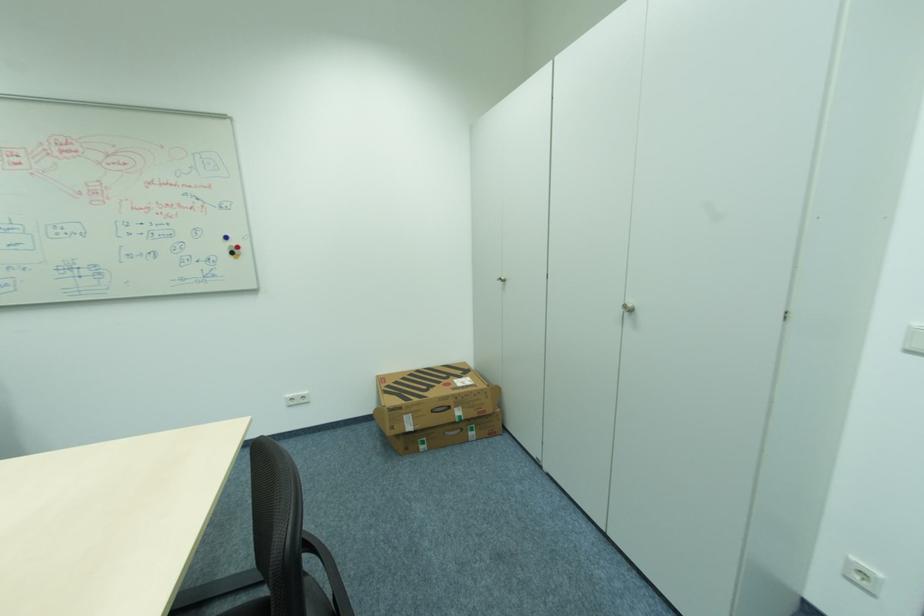
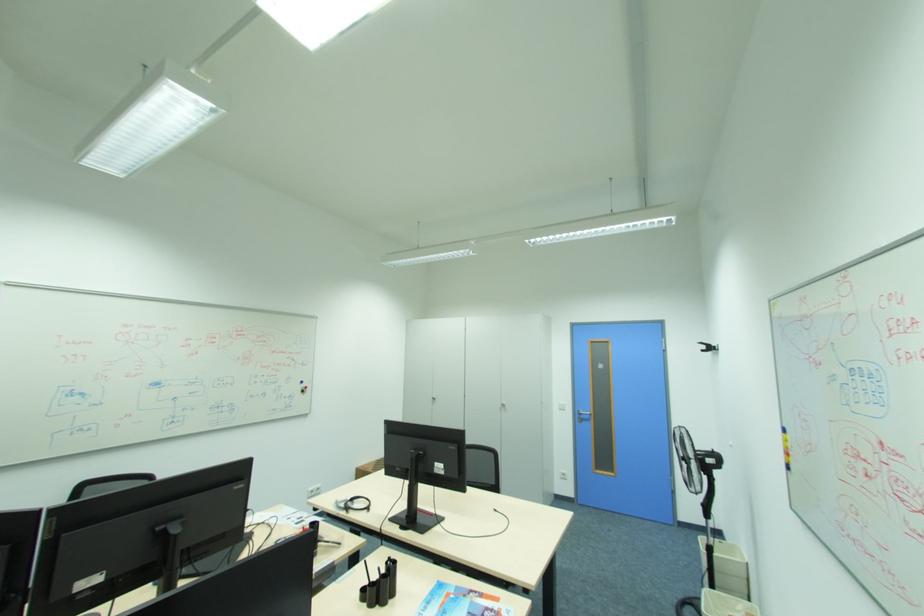
The point at (637, 310) is marked in the first image. Where is the corresponding point in the second image?

(508, 406)